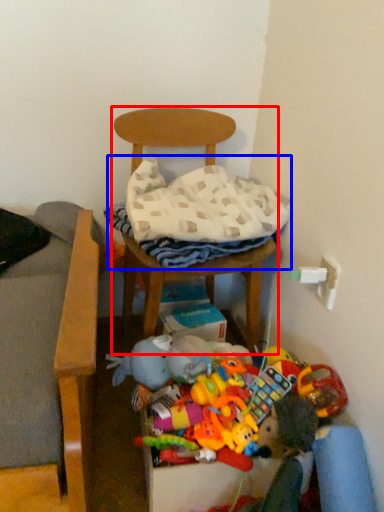
Question: Which object is further to the camera taking this photo, chair (highlighted by a red box) or blanket (highlighted by a blue box)?

Choices:
 (A) chair
 (B) blanket

Answer: (B)